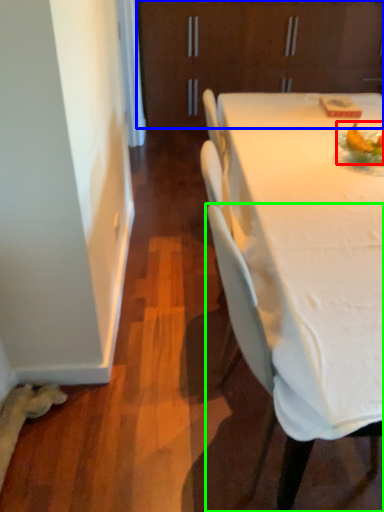
Question: Which object is the farthest from food (highlighted by a red box)? Choose among these: cabinetry (highlighted by a blue box) or chair (highlighted by a green box).

Choices:
 (A) cabinetry
 (B) chair

Answer: (A)